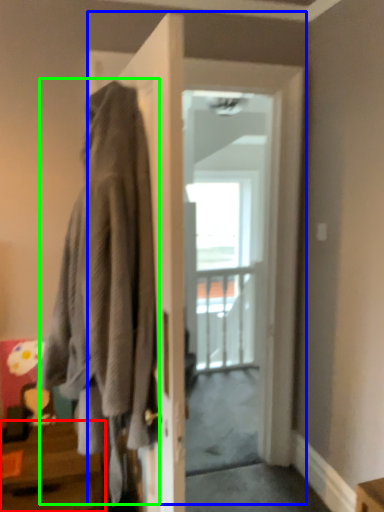
Question: Which object is positioned closest to table (highlighted by a red box)? Select from door (highlighted by a blue box) and laundry (highlighted by a green box).

Choices:
 (A) door
 (B) laundry

Answer: (B)